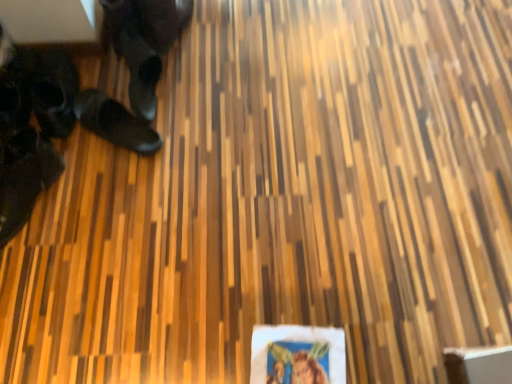
Question: Is black rubber shoes at left, acting as the first footwear starting from the right, aimed at black leather shoes at left, placed as the 2th footwear when sorted from right to left?

Choices:
 (A) no
 (B) yes

Answer: (A)

Question: Considering the relative sizes of black rubber shoes at left, acting as the first footwear starting from the right, and black leather shoes at left, which appears as the 2th footwear when viewed from the left, in the image provided, is black rubber shoes at left, acting as the first footwear starting from the right, thinner than black leather shoes at left, which appears as the 2th footwear when viewed from the left,?

Choices:
 (A) yes
 (B) no

Answer: (A)

Question: Are black rubber shoes at left, acting as the first footwear starting from the right, and black leather shoes at left, which appears as the 2th footwear when viewed from the left, making contact?

Choices:
 (A) no
 (B) yes

Answer: (A)

Question: Considering the relative sizes of black rubber shoes at left, acting as the first footwear starting from the right, and black leather shoes at left, placed as the 2th footwear when sorted from right to left, in the image provided, is black rubber shoes at left, acting as the first footwear starting from the right, wider than black leather shoes at left, placed as the 2th footwear when sorted from right to left,?

Choices:
 (A) no
 (B) yes

Answer: (A)

Question: Is black rubber shoes at left, acting as the first footwear starting from the right, to the left of black leather shoes at left, which appears as the 2th footwear when viewed from the left, from the viewer's perspective?

Choices:
 (A) no
 (B) yes

Answer: (A)

Question: Based on their sizes in the image, would you say black leather shoe at lower left, the 3th footwear when ordered from right to left, is bigger or smaller than black rubber shoes at left, acting as the first footwear starting from the right?

Choices:
 (A) small
 (B) big

Answer: (B)

Question: From the image's perspective, is black leather shoe at lower left, the 3th footwear when ordered from right to left, positioned above or below black rubber shoes at left, acting as the first footwear starting from the right?

Choices:
 (A) above
 (B) below

Answer: (B)

Question: In the image, is black leather shoe at lower left, the 3th footwear when ordered from right to left, on the left side or the right side of black rubber shoes at left, placed as the third footwear when sorted from left to right?

Choices:
 (A) left
 (B) right

Answer: (A)

Question: Is black leather shoe at lower left, the 3th footwear when ordered from right to left, taller or shorter than black rubber shoes at left, acting as the first footwear starting from the right?

Choices:
 (A) short
 (B) tall

Answer: (B)

Question: Is black leather shoe at lower left, placed as the 1th footwear when sorted from left to right, taller or shorter than black leather shoes at left, which appears as the 2th footwear when viewed from the left?

Choices:
 (A) tall
 (B) short

Answer: (A)

Question: Based on their positions, is black leather shoe at lower left, the 3th footwear when ordered from right to left, located to the left or right of black leather shoes at left, placed as the 2th footwear when sorted from right to left?

Choices:
 (A) left
 (B) right

Answer: (A)

Question: Is black leather shoe at lower left, the 3th footwear when ordered from right to left, inside or outside of black leather shoes at left, which appears as the 2th footwear when viewed from the left?

Choices:
 (A) inside
 (B) outside

Answer: (B)

Question: From a real-world perspective, relative to black leather shoes at left, which appears as the 2th footwear when viewed from the left, is black leather shoe at lower left, placed as the 1th footwear when sorted from left to right, vertically above or below?

Choices:
 (A) below
 (B) above

Answer: (B)

Question: From the image's perspective, is black leather shoes at left, placed as the 2th footwear when sorted from right to left, positioned above or below black leather shoe at lower left, placed as the 1th footwear when sorted from left to right?

Choices:
 (A) above
 (B) below

Answer: (A)

Question: In the image, is black leather shoes at left, placed as the 2th footwear when sorted from right to left, on the left side or the right side of black leather shoe at lower left, placed as the 1th footwear when sorted from left to right?

Choices:
 (A) right
 (B) left

Answer: (A)